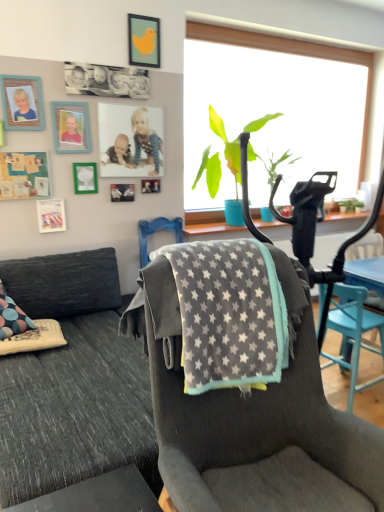
Question: Does point (31, 87) appear closer or farther from the camera than point (251, 406)?

Choices:
 (A) farther
 (B) closer

Answer: (A)

Question: In terms of height, does wooden photo frame at upper left, placed as the eighth picture frame when sorted from bottom to top, look taller or shorter compared to gray fleece blanket at center, the first chair when ordered from left to right?

Choices:
 (A) short
 (B) tall

Answer: (A)

Question: Which is farther from the velvet gray couch at center?

Choices:
 (A) metallic silver photo frame at center, which is the sixth picture frame from top to bottom
 (B) green leafy plant at center
 (C) wooden photo frame at upper left, placed as the second picture frame when sorted from top to bottom
 (D) teal wooden picture frame at upper left, positioned as the seventh picture frame in bottom-to-top order
 (E) gray fabric chair at center, placed as the 2th chair when sorted from front to back

Answer: (B)

Question: Which object is positioned closest to the matte plastic photo frame at upper center, which is the 6th picture frame from bottom to top?

Choices:
 (A) metallic silver picture frame at upper left, acting as the ninth picture frame starting from the top
 (B) teal wooden picture frame at upper left, positioned as the seventh picture frame in bottom-to-top order
 (C) wooden photo frame at upper left, placed as the eighth picture frame when sorted from bottom to top
 (D) gray fleece blanket at center, which is the second chair in right-to-left order
 (E) velvet gray couch at center

Answer: (B)